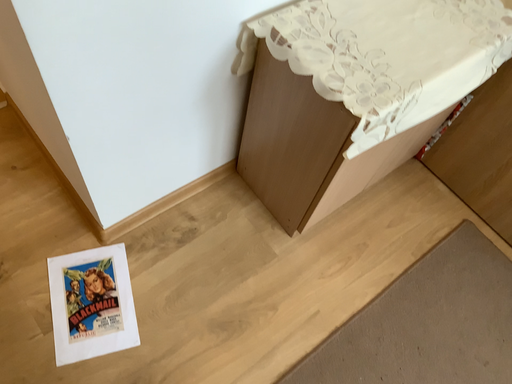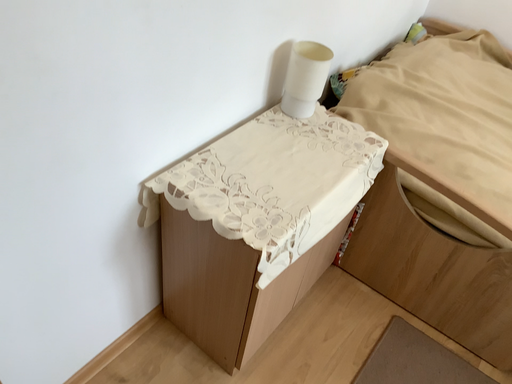
Question: How did the camera likely rotate when shooting the video?

Choices:
 (A) rotated left
 (B) rotated right

Answer: (B)